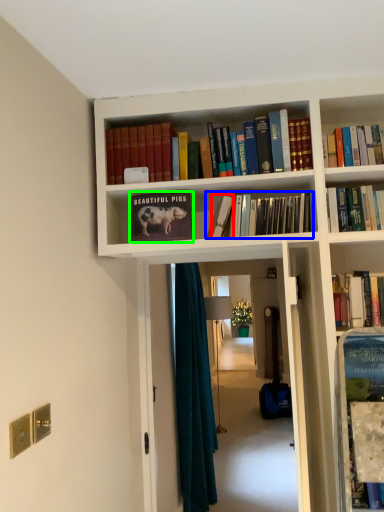
Question: Which object is the closest to the book (highlighted by a red box)? Choose among these: book (highlighted by a blue box) or book (highlighted by a green box).

Choices:
 (A) book
 (B) book

Answer: (A)